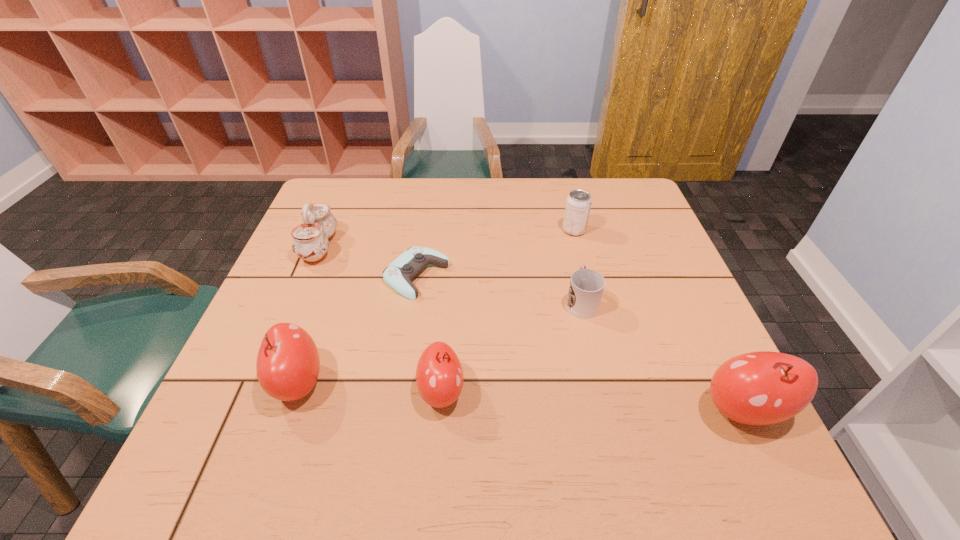
Image resolution: width=960 pixels, height=540 pixels. I want to click on object positioned at the near right corner, so click(x=760, y=388).

Locate an element on the screen. vacant region at the far edge of the desktop is located at coordinates (475, 180).

Locate an element on the screen. This screenshot has height=540, width=960. vacant region at the near edge of the desktop is located at coordinates (529, 403).

Where is `vacant space at the left edge of the desktop`? This screenshot has width=960, height=540. vacant space at the left edge of the desktop is located at coordinates (300, 292).

The image size is (960, 540). Find the location of `vacant space at the right edge of the desktop`. vacant space at the right edge of the desktop is located at coordinates (637, 252).

Identify the location of free space at the near left corner. tap(278, 400).

In the image, there is a desktop. Where is `vacant space at the far right corner`? vacant space at the far right corner is located at coordinates (615, 218).

Identify the location of vacant space at the near right corner. (703, 426).

Image resolution: width=960 pixels, height=540 pixels. I want to click on empty space between the rightmost apple and the shortest apple, so click(592, 401).

You are a GUI agent. You are given a task and a screenshot of the screen. Output one action in this format:
    pyautogui.click(x=<x>, y=<y>)
    Task: Click on the free space between the control and the cup
    Image resolution: width=960 pixels, height=540 pixels.
    Given the screenshot: What is the action you would take?
    pyautogui.click(x=498, y=289)